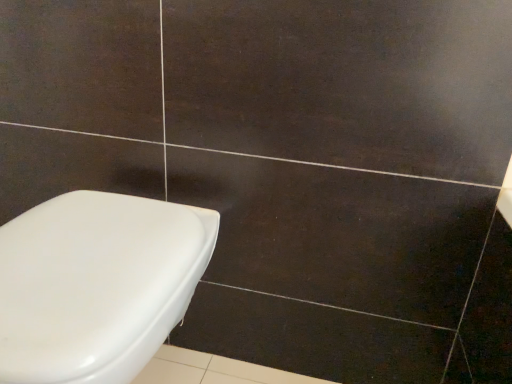
Question: Should I look upward or downward to see white glossy toilet at lower left?

Choices:
 (A) up
 (B) down

Answer: (B)